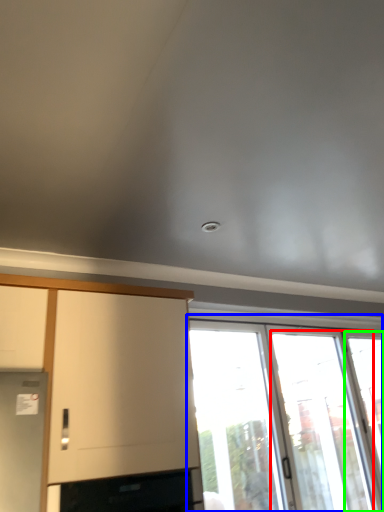
Question: Which is farther away from screen door (highlighted by a red box)? window (highlighted by a blue box) or window (highlighted by a green box)?

Choices:
 (A) window
 (B) window

Answer: (B)